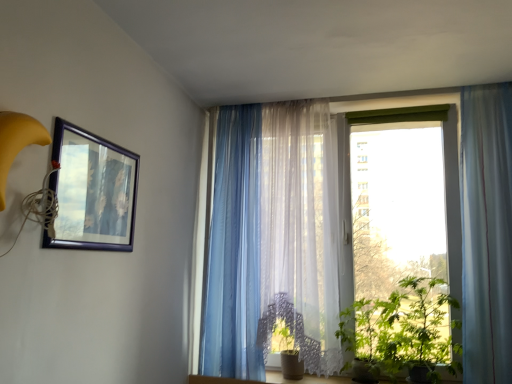
Question: Is green leafy plant at right looking in the opposite direction of translucent blue curtain at right, the third curtain when ordered from left to right?

Choices:
 (A) yes
 (B) no

Answer: (B)

Question: Does green leafy plant at right turn towards translucent blue curtain at right, the 1th curtain in the right-to-left sequence?

Choices:
 (A) no
 (B) yes

Answer: (A)

Question: Would you say translucent blue curtain at right, the 1th curtain in the right-to-left sequence, is part of green leafy plant at right's contents?

Choices:
 (A) no
 (B) yes

Answer: (A)

Question: Is green leafy plant at right wider than translucent blue curtain at right, the third curtain when ordered from left to right?

Choices:
 (A) no
 (B) yes

Answer: (B)

Question: From the image's perspective, is green leafy plant at right over translucent blue curtain at right, the 1th curtain in the right-to-left sequence?

Choices:
 (A) yes
 (B) no

Answer: (B)

Question: Does green leafy plant at right lie in front of translucent blue curtain at right, the 1th curtain in the right-to-left sequence?

Choices:
 (A) no
 (B) yes

Answer: (A)

Question: Considering the relative sizes of matte black picture frame at upper left and translucent blue curtain at right, the third curtain when ordered from left to right, in the image provided, is matte black picture frame at upper left wider than translucent blue curtain at right, the third curtain when ordered from left to right,?

Choices:
 (A) no
 (B) yes

Answer: (A)

Question: Considering the relative sizes of matte black picture frame at upper left and translucent blue curtain at right, the third curtain when ordered from left to right, in the image provided, is matte black picture frame at upper left smaller than translucent blue curtain at right, the third curtain when ordered from left to right,?

Choices:
 (A) yes
 (B) no

Answer: (A)

Question: Can you confirm if matte black picture frame at upper left is positioned to the right of translucent blue curtain at right, the 1th curtain in the right-to-left sequence?

Choices:
 (A) yes
 (B) no

Answer: (B)

Question: From a real-world perspective, is matte black picture frame at upper left positioned under translucent blue curtain at right, the 1th curtain in the right-to-left sequence, based on gravity?

Choices:
 (A) yes
 (B) no

Answer: (B)

Question: Does matte black picture frame at upper left come behind translucent blue curtain at right, the third curtain when ordered from left to right?

Choices:
 (A) no
 (B) yes

Answer: (A)

Question: Could you tell me if matte black picture frame at upper left is facing translucent blue curtain at right, the third curtain when ordered from left to right?

Choices:
 (A) no
 (B) yes

Answer: (A)

Question: Considering the relative sizes of translucent fabric at center and translucent blue curtain at right, the third curtain when ordered from left to right, in the image provided, is translucent fabric at center bigger than translucent blue curtain at right, the third curtain when ordered from left to right,?

Choices:
 (A) yes
 (B) no

Answer: (A)